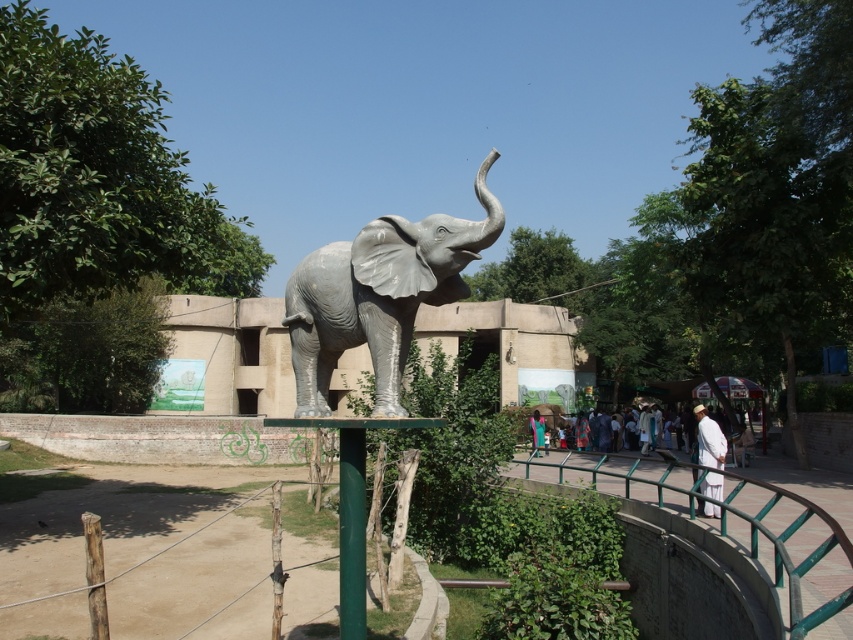
Consider the image. Is sanded gray elephant at center positioned in front of light blue fabric at center?

Yes, it is.

Is sanded gray elephant at center shorter than light blue fabric at center?

No.

Is point (329, 326) positioned after point (532, 435)?

No, (329, 326) is in front of (532, 435).

This screenshot has height=640, width=853. Identify the location of sanded gray elephant at center. (378, 296).

Does green metal railing at lower right have a lesser width compared to white cotton clothing at lower right?

In fact, green metal railing at lower right might be wider than white cotton clothing at lower right.

Is green metal railing at lower right to the left of white cotton clothing at lower right from the viewer's perspective?

Correct, you'll find green metal railing at lower right to the left of white cotton clothing at lower right.

Does point (836, 541) come behind point (699, 410)?

That is False.

I want to click on green metal railing at lower right, so click(x=728, y=561).

This screenshot has width=853, height=640. Describe the element at coordinates (351, 532) in the screenshot. I see `green painted metal pole at lower center` at that location.

Is green painted metal pole at lower center smaller than light blue fabric at center?

Yes.

The image size is (853, 640). What are the coordinates of `green painted metal pole at lower center` in the screenshot? It's located at (351, 532).